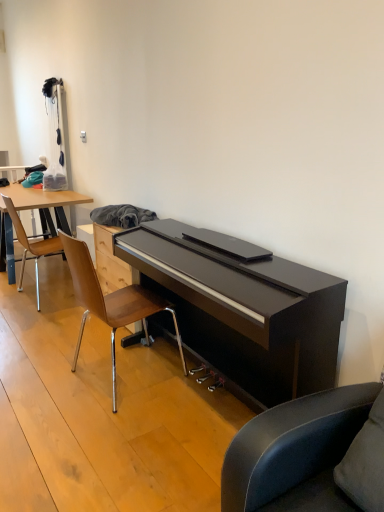
Locate an element on the screen. wooden/metallic chair at center, positioned as the second chair in left-to-right order is located at coordinates (111, 302).

Describe the element at coordinates (111, 302) in the screenshot. I see `wooden/metallic chair at center, which appears as the 1th chair when viewed from the front` at that location.

Consider the image. What is the approximate width of wooden/metallic chair at center, positioned as the second chair in left-to-right order?

The width of wooden/metallic chair at center, positioned as the second chair in left-to-right order, is 23.33 inches.

This screenshot has width=384, height=512. What do you see at coordinates (32, 246) in the screenshot?
I see `wooden polished chair at left, positioned as the 1th chair in back-to-front order` at bounding box center [32, 246].

Looking at this image, how much space does wooden polished chair at left, which appears as the 1th chair when viewed from the left, occupy vertically?

Answer: The height of wooden polished chair at left, which appears as the 1th chair when viewed from the left, is 34.21 inches.

I want to click on wooden polished chair at left, positioned as the 1th chair in back-to-front order, so click(32, 246).

How much space does wooden polished chair at left, positioned as the 1th chair in back-to-front order, occupy horizontally?

22.47 inches.

Where is `wooden/metallic chair at center, which appears as the 1th chair when viewed from the front`? The height and width of the screenshot is (512, 384). wooden/metallic chair at center, which appears as the 1th chair when viewed from the front is located at coordinates (111, 302).

Considering the relative positions of wooden polished chair at left, which is the 2th chair in right-to-left order, and wooden/metallic chair at center, positioned as the second chair in left-to-right order, in the image provided, is wooden polished chair at left, which is the 2th chair in right-to-left order, to the right of wooden/metallic chair at center, positioned as the second chair in left-to-right order, from the viewer's perspective?

No.

Relative to wooden/metallic chair at center, positioned as the second chair in left-to-right order, is wooden polished chair at left, which appears as the 1th chair when viewed from the left, in front or behind?

In the image, wooden polished chair at left, which appears as the 1th chair when viewed from the left, appears behind wooden/metallic chair at center, positioned as the second chair in left-to-right order.

Which is behind, point (63, 247) or point (114, 364)?

The point (63, 247) is farther from the camera.

From the image's perspective, which one is positioned lower, wooden polished chair at left, which is counted as the second chair, starting from the front, or wooden/metallic chair at center, positioned as the second chair in left-to-right order?

From the image's view, wooden/metallic chair at center, positioned as the second chair in left-to-right order, is below.

From a real-world perspective, is wooden polished chair at left, which is the 2th chair in right-to-left order, located higher than wooden/metallic chair at center, the 2th chair positioned from the back?

No, from a real-world perspective, wooden polished chair at left, which is the 2th chair in right-to-left order, is not over wooden/metallic chair at center, the 2th chair positioned from the back

Between wooden polished chair at left, which appears as the 1th chair when viewed from the left, and wooden/metallic chair at center, the 1th chair from the right, which one has smaller width?

With smaller width is wooden polished chair at left, which appears as the 1th chair when viewed from the left.

In the scene shown: Considering the sizes of objects wooden polished chair at left, which is counted as the second chair, starting from the front, and wooden/metallic chair at center, positioned as the second chair in left-to-right order, in the image provided, who is taller, wooden polished chair at left, which is counted as the second chair, starting from the front, or wooden/metallic chair at center, positioned as the second chair in left-to-right order,?

With more height is wooden/metallic chair at center, positioned as the second chair in left-to-right order.

Between wooden polished chair at left, positioned as the 1th chair in back-to-front order, and wooden/metallic chair at center, positioned as the second chair in left-to-right order, which one has smaller size?

With smaller size is wooden polished chair at left, positioned as the 1th chair in back-to-front order.

Is wooden polished chair at left, positioned as the 1th chair in back-to-front order, completely or partially outside of wooden/metallic chair at center, the 2th chair positioned from the back?

wooden polished chair at left, positioned as the 1th chair in back-to-front order, lies outside wooden/metallic chair at center, the 2th chair positioned from the back,'s area.

Is wooden polished chair at left, which is the 2th chair in right-to-left order, positioned far away from wooden/metallic chair at center, the 2th chair positioned from the back?

Yes.

Is wooden polished chair at left, which is counted as the second chair, starting from the front, turned away from wooden/metallic chair at center, which appears as the 1th chair when viewed from the front?

No.

What's the angular difference between wooden polished chair at left, which is counted as the second chair, starting from the front, and wooden/metallic chair at center, the 1th chair from the right,'s facing directions?

The facing directions of wooden polished chair at left, which is counted as the second chair, starting from the front, and wooden/metallic chair at center, the 1th chair from the right, are 0.00225 degrees apart.

Locate an element on the screen. chair on the right of wooden polished chair at left, which is counted as the second chair, starting from the front is located at coordinates (111, 302).

Based on their positions, is wooden/metallic chair at center, positioned as the second chair in left-to-right order, located to the left or right of wooden polished chair at left, which is the 2th chair in right-to-left order?

wooden/metallic chair at center, positioned as the second chair in left-to-right order, is positioned on wooden polished chair at left, which is the 2th chair in right-to-left order,'s right side.

Looking at this image, considering the relative positions of wooden/metallic chair at center, which appears as the 1th chair when viewed from the front, and wooden polished chair at left, which is counted as the second chair, starting from the front, in the image provided, is wooden/metallic chair at center, which appears as the 1th chair when viewed from the front, in front of wooden polished chair at left, which is counted as the second chair, starting from the front,?

Yes, wooden/metallic chair at center, which appears as the 1th chair when viewed from the front, is closer to the camera.

Considering the positions of points (114, 332) and (23, 272), is point (114, 332) closer to camera compared to point (23, 272)?

Yes, it is in front of point (23, 272).

From the image's perspective, is wooden/metallic chair at center, which appears as the 1th chair when viewed from the front, beneath wooden polished chair at left, positioned as the 1th chair in back-to-front order?

Yes.

From a real-world perspective, is wooden/metallic chair at center, which appears as the 1th chair when viewed from the front, located higher than wooden polished chair at left, which appears as the 1th chair when viewed from the left?

Yes, from a real-world perspective, wooden/metallic chair at center, which appears as the 1th chair when viewed from the front, is on top of wooden polished chair at left, which appears as the 1th chair when viewed from the left.

In the scene shown: Which of these two, wooden/metallic chair at center, positioned as the second chair in left-to-right order, or wooden polished chair at left, positioned as the 1th chair in back-to-front order, is wider?

With larger width is wooden/metallic chair at center, positioned as the second chair in left-to-right order.

Is wooden/metallic chair at center, positioned as the second chair in left-to-right order, taller than wooden polished chair at left, which appears as the 1th chair when viewed from the left?

Yes.

In terms of size, does wooden/metallic chair at center, the 1th chair from the right, appear bigger or smaller than wooden polished chair at left, which is the 2th chair in right-to-left order?

In the image, wooden/metallic chair at center, the 1th chair from the right, appears to be larger than wooden polished chair at left, which is the 2th chair in right-to-left order.

Is wooden/metallic chair at center, which appears as the 1th chair when viewed from the front, inside or outside of wooden polished chair at left, which appears as the 1th chair when viewed from the left?

The correct answer is: outside.

Can you see wooden/metallic chair at center, which appears as the 1th chair when viewed from the front, touching wooden polished chair at left, which appears as the 1th chair when viewed from the left?

wooden/metallic chair at center, which appears as the 1th chair when viewed from the front, and wooden polished chair at left, which appears as the 1th chair when viewed from the left, are clearly separated.

Is wooden/metallic chair at center, the 1th chair from the right, positioned with its back to wooden polished chair at left, positioned as the 1th chair in back-to-front order?

wooden/metallic chair at center, the 1th chair from the right, is not turned away from wooden polished chair at left, positioned as the 1th chair in back-to-front order.

How many degrees apart are the facing directions of wooden/metallic chair at center, positioned as the second chair in left-to-right order, and wooden polished chair at left, which is counted as the second chair, starting from the front?

0.00225 degrees separate the facing orientations of wooden/metallic chair at center, positioned as the second chair in left-to-right order, and wooden polished chair at left, which is counted as the second chair, starting from the front.

Measure the distance between wooden/metallic chair at center, the 1th chair from the right, and wooden polished chair at left, which is the 2th chair in right-to-left order.

The distance of wooden/metallic chair at center, the 1th chair from the right, from wooden polished chair at left, which is the 2th chair in right-to-left order, is 3.63 feet.

Identify the location of chair below the wooden polished chair at left, which is counted as the second chair, starting from the front (from the image's perspective). (111, 302).

At what (x,y) coordinates should I click in order to perform the action: click on chair below the wooden/metallic chair at center, the 1th chair from the right (from a real-world perspective). Please return your answer as a coordinate pair (x, y). Image resolution: width=384 pixels, height=512 pixels. Looking at the image, I should click on (32, 246).

Where is `chair on the left side of wooden/metallic chair at center, positioned as the second chair in left-to-right order`? This screenshot has height=512, width=384. chair on the left side of wooden/metallic chair at center, positioned as the second chair in left-to-right order is located at coordinates (32, 246).